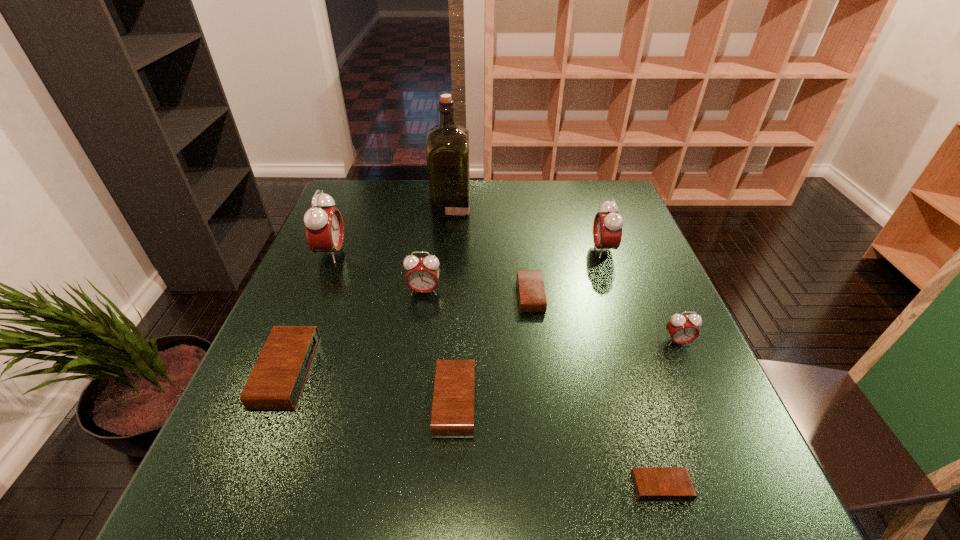
Identify the location of the fourth shortest alarm clock. (277, 380).

This screenshot has height=540, width=960. I want to click on the fourth shortest object, so click(277, 380).

Locate an element on the screen. The image size is (960, 540). the fourth alarm clock from left to right is located at coordinates (452, 415).

The height and width of the screenshot is (540, 960). Identify the location of the third shortest alarm clock. (452, 415).

Locate an element on the screen. the second smallest black alarm clock is located at coordinates (532, 298).

Locate an element on the screen. This screenshot has width=960, height=540. the eighth tallest object is located at coordinates (532, 298).

Locate an element on the screen. the rightmost black alarm clock is located at coordinates (652, 484).

The width and height of the screenshot is (960, 540). In order to click on the smallest black alarm clock in this screenshot , I will do `click(652, 484)`.

Find the location of a particular element. free spot located on the label of the tallest object is located at coordinates (599, 206).

Find the location of a particular element. The width and height of the screenshot is (960, 540). free region located 0.220m on the clock face of the leftmost pink alarm clock is located at coordinates (425, 253).